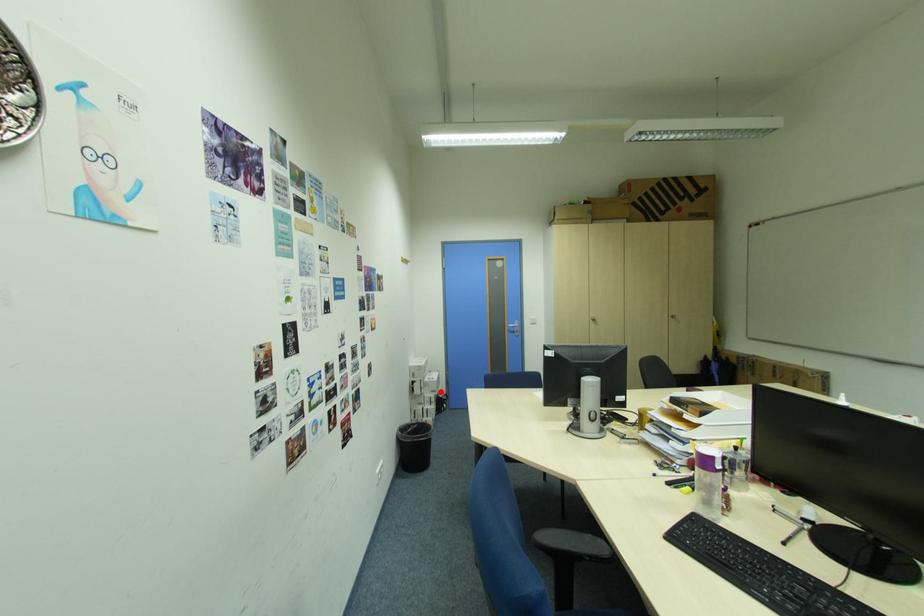
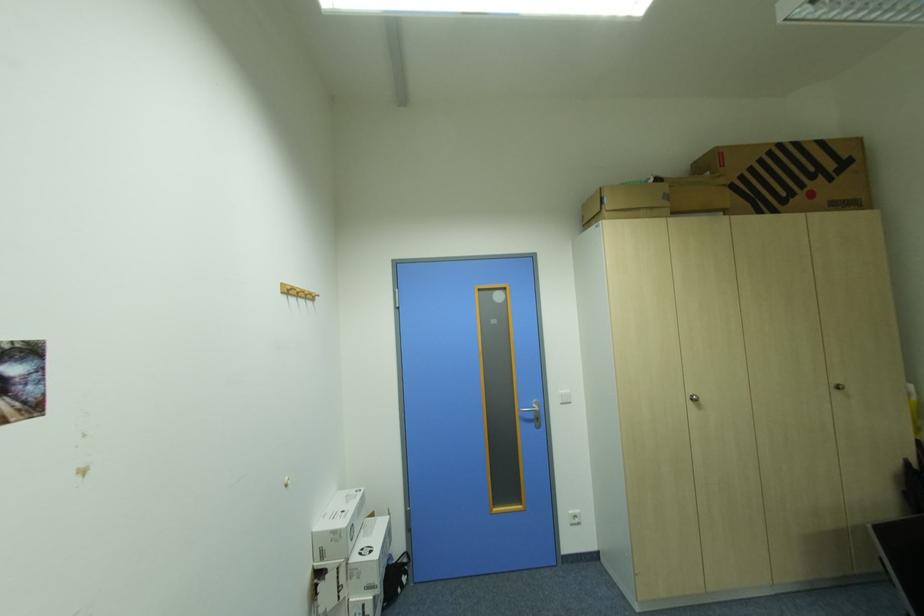
Question: A red point is marked in image1. In image2, is the corresponding 3D point closer to the camera or farther? Reply with the corresponding letter.

Choices:
 (A) The corresponding 3D point is closer.
 (B) The corresponding 3D point is farther.

Answer: (A)